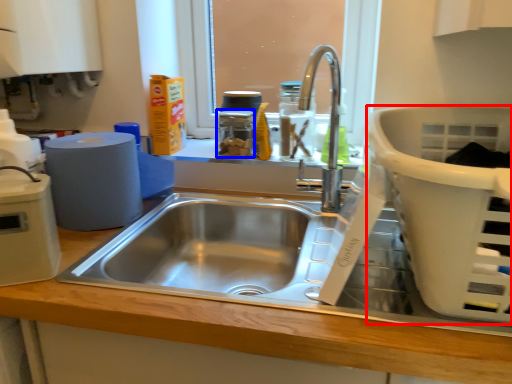
Question: Which of the following is the closest to the observer, basket (highlighted by a red box) or appliance (highlighted by a blue box)?

Choices:
 (A) basket
 (B) appliance

Answer: (A)